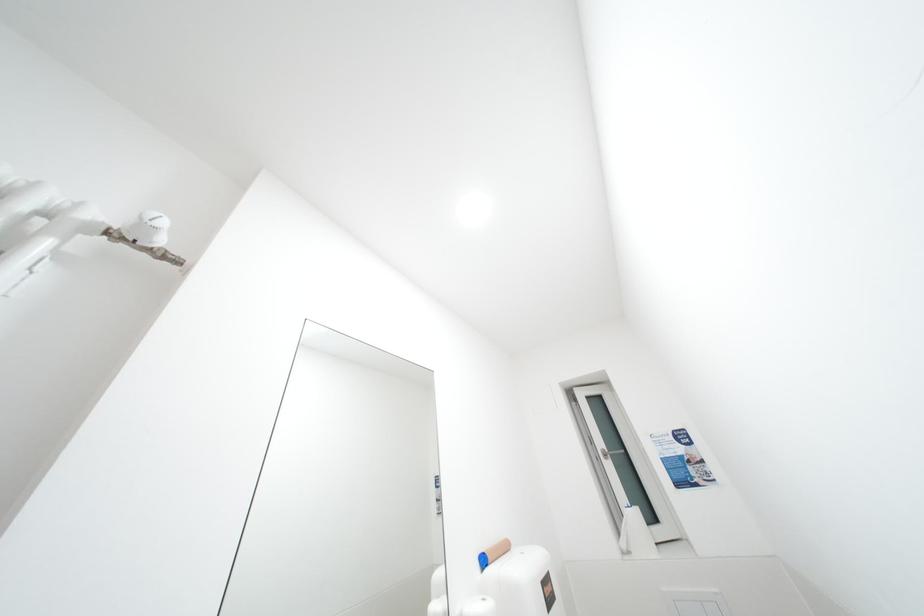
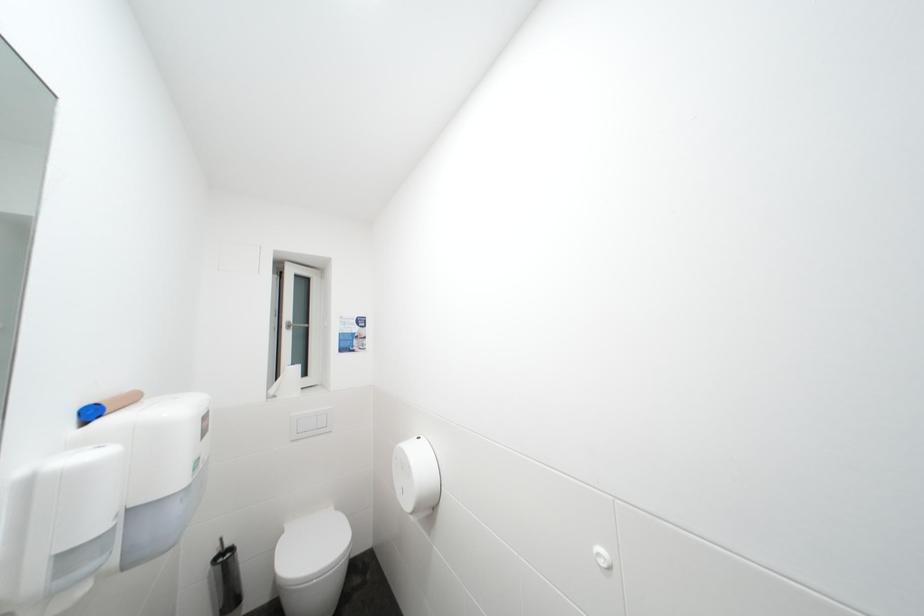
Question: Based on the continuous images, in which direction is the camera rotating? Reply with the corresponding letter.

Choices:
 (A) Left
 (B) Right
 (C) Up
 (D) Down

Answer: (B)